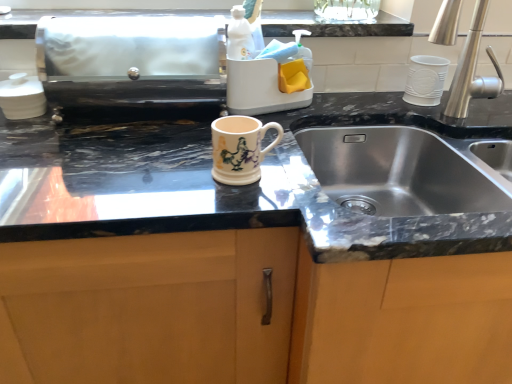
Question: From the image's perspective, is white glossy sink at upper center located above or below matte ceramic mug at center?

Choices:
 (A) above
 (B) below

Answer: (A)

Question: Considering their positions, is white glossy sink at upper center located in front of or behind matte ceramic mug at center?

Choices:
 (A) behind
 (B) front

Answer: (A)

Question: Considering the real-world distances, which object is farthest from the silver metallic faucet at right?

Choices:
 (A) white glossy sink at upper center
 (B) matte ceramic mug at center

Answer: (B)

Question: Which object is the farthest from the white glossy sink at upper center?

Choices:
 (A) matte ceramic mug at center
 (B) silver metallic faucet at right

Answer: (A)